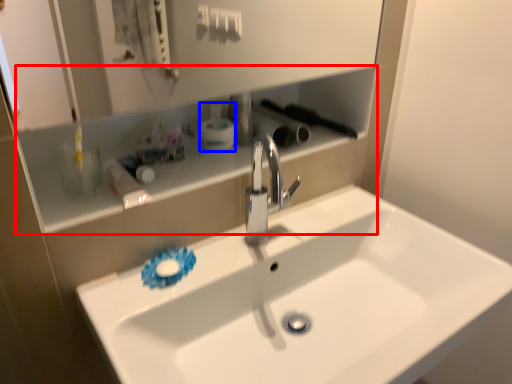
Question: Which point is closer to the camera, shelve (highlighted by a red box) or mouthwash (highlighted by a blue box)?

Choices:
 (A) shelve
 (B) mouthwash

Answer: (A)